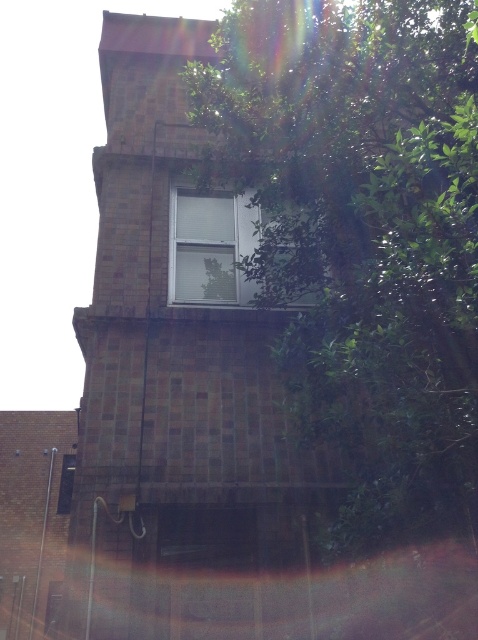
You are a photographer trying to capture a detailed shot of two points marked in the image. The first point is at coordinate point (408, 365) and the second is at point (242, 282). Since you want to focus on the one that is closer to you, which point should you choose?

Point (408, 365) is closer to the camera than point (242, 282), so you should focus on point (408, 365).

You are standing in front of a building and want to take a photo of the white matte window at center without any obstruction. However, the green leafy tree at upper right is blocking part of it. To achieve an unobstructed view, which direction should you move relative to the building?

The green leafy tree at upper right is positioned on the right side of the white matte window at center. To avoid the obstruction, you should move to the left side of the building so that the tree moves out of the frame relative to the window.

You are a window installer assessing the building. You need to replace the white matte window at center. Considering the green leafy tree at upper right, will you need to trim branches before installation?

The green leafy tree at upper right is much taller than the white matte window at center, so branches may obstruct the window replacement process. Trimming the branches would be necessary before installation.